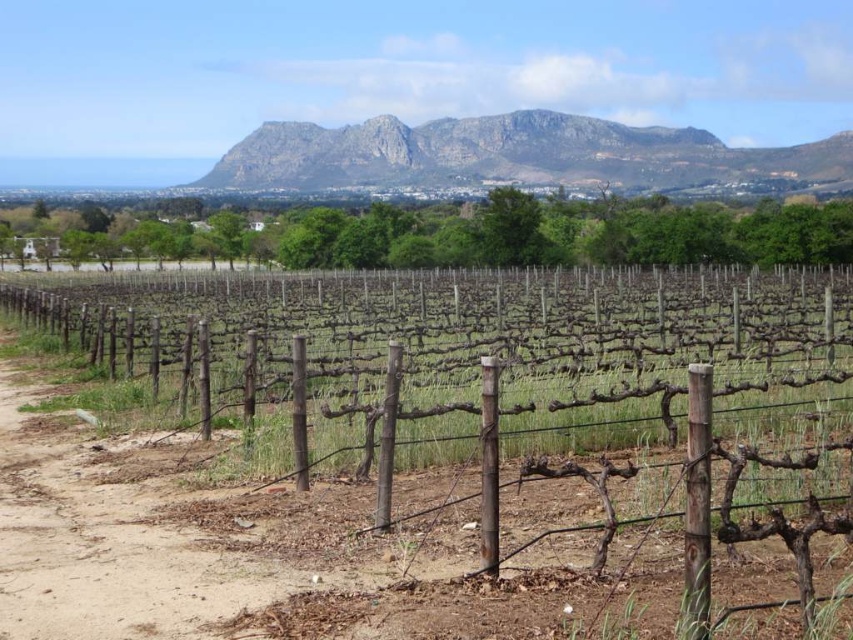
The width and height of the screenshot is (853, 640). I want to click on brown wooden fence at center, so click(480, 364).

Is point (341, 440) closer to camera compared to point (367, 150)?

Yes, it is in front of point (367, 150).

Is point (427, 381) positioned after point (209, 170)?

That is False.

The image size is (853, 640). What are the coordinates of `brown wooden fence at center` in the screenshot? It's located at (480, 364).